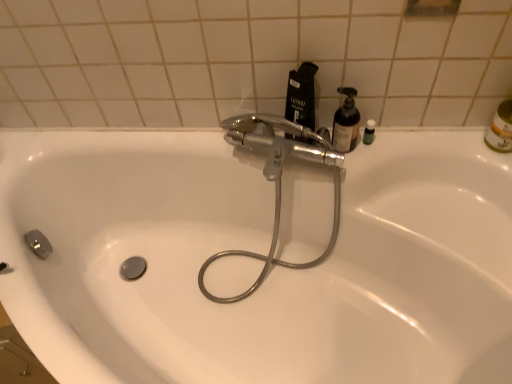
Question: From the image's perspective, is green matte bottle at upper right beneath translucent plastic bottle at upper right?

Choices:
 (A) no
 (B) yes

Answer: (B)

Question: Is green matte bottle at upper right turned away from translucent plastic bottle at upper right?

Choices:
 (A) no
 (B) yes

Answer: (A)

Question: Is green matte bottle at upper right next to translucent plastic bottle at upper right?

Choices:
 (A) yes
 (B) no

Answer: (A)

Question: Is green matte bottle at upper right not inside translucent plastic bottle at upper right?

Choices:
 (A) no
 (B) yes

Answer: (B)

Question: Considering the relative sizes of green matte bottle at upper right and translucent plastic bottle at upper right in the image provided, is green matte bottle at upper right shorter than translucent plastic bottle at upper right?

Choices:
 (A) no
 (B) yes

Answer: (B)

Question: From the image's perspective, is green matte bottle at upper right over translucent plastic bottle at upper right?

Choices:
 (A) no
 (B) yes

Answer: (A)

Question: From the image's perspective, is black matte bottle at upper center on top of white glossy sink at center?

Choices:
 (A) yes
 (B) no

Answer: (A)

Question: Is black matte bottle at upper center closer to the viewer compared to white glossy sink at center?

Choices:
 (A) yes
 (B) no

Answer: (B)

Question: Can you confirm if black matte bottle at upper center is bigger than white glossy sink at center?

Choices:
 (A) yes
 (B) no

Answer: (B)

Question: Is black matte bottle at upper center not close to white glossy sink at center?

Choices:
 (A) yes
 (B) no

Answer: (B)

Question: From a real-world perspective, is black matte bottle at upper center below white glossy sink at center?

Choices:
 (A) no
 (B) yes

Answer: (A)

Question: From a real-world perspective, does black matte bottle at upper center stand above white glossy sink at center?

Choices:
 (A) yes
 (B) no

Answer: (A)

Question: Is white glossy sink at center aimed at chrome metallic faucet at center?

Choices:
 (A) no
 (B) yes

Answer: (B)